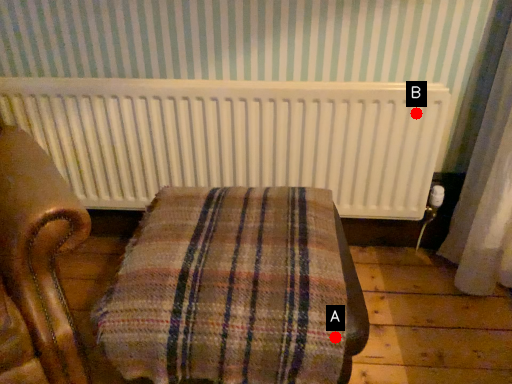
Question: Two points are circled on the image, labeled by A and B beside each circle. Which point is closer to the camera taking this photo?

Choices:
 (A) A is closer
 (B) B is closer

Answer: (A)